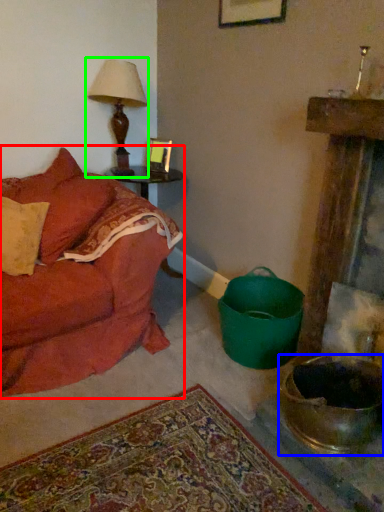
Question: Which object is positioned closest to studio couch (highlighted by a red box)? Select from mixing bowl (highlighted by a blue box) and table lamp (highlighted by a green box).

Choices:
 (A) mixing bowl
 (B) table lamp

Answer: (B)